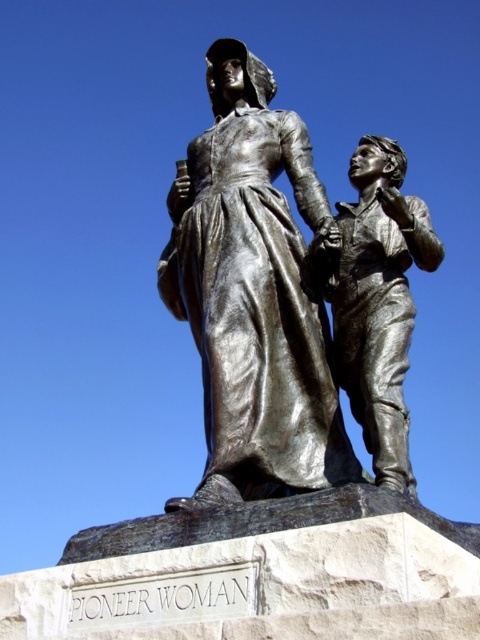
Does shiny bronze statue at center lie in front of polished bronze statue at center?

Yes, shiny bronze statue at center is in front of polished bronze statue at center.

This screenshot has width=480, height=640. Identify the location of shiny bronze statue at center. (253, 294).

Describe the element at coordinates (253, 294) in the screenshot. I see `shiny bronze statue at center` at that location.

Find the location of `shiny bronze statue at center`. shiny bronze statue at center is located at coordinates (253, 294).